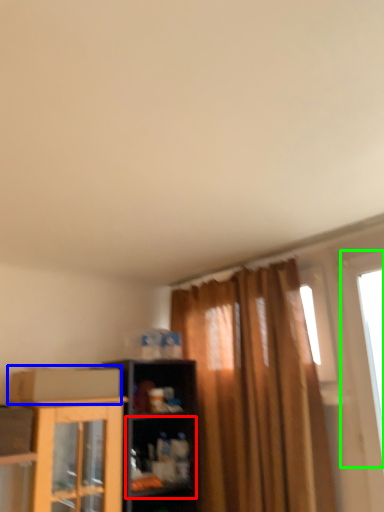
Question: Which is nearer to the shelf (highlighted by a red box)? cardboard box (highlighted by a blue box) or window (highlighted by a green box).

Choices:
 (A) cardboard box
 (B) window

Answer: (A)